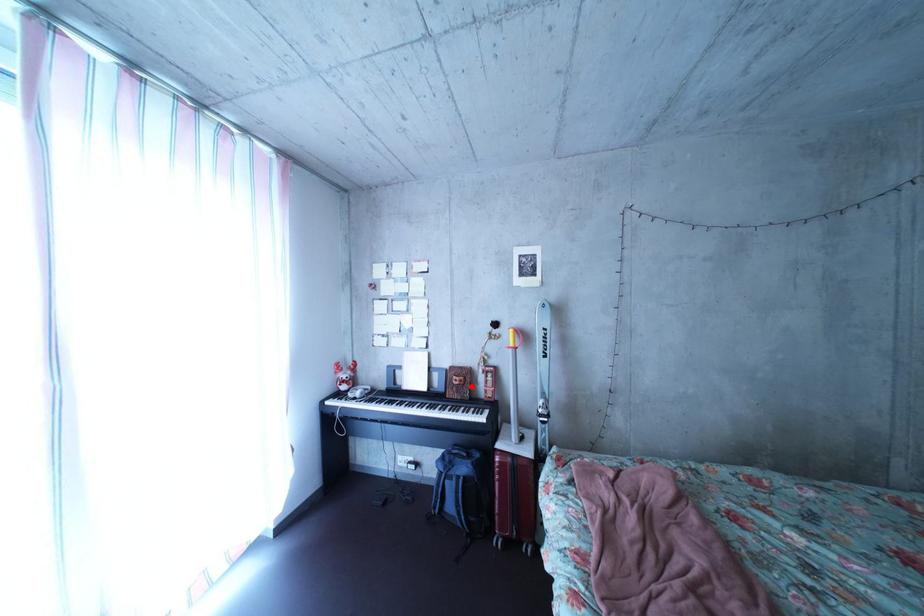
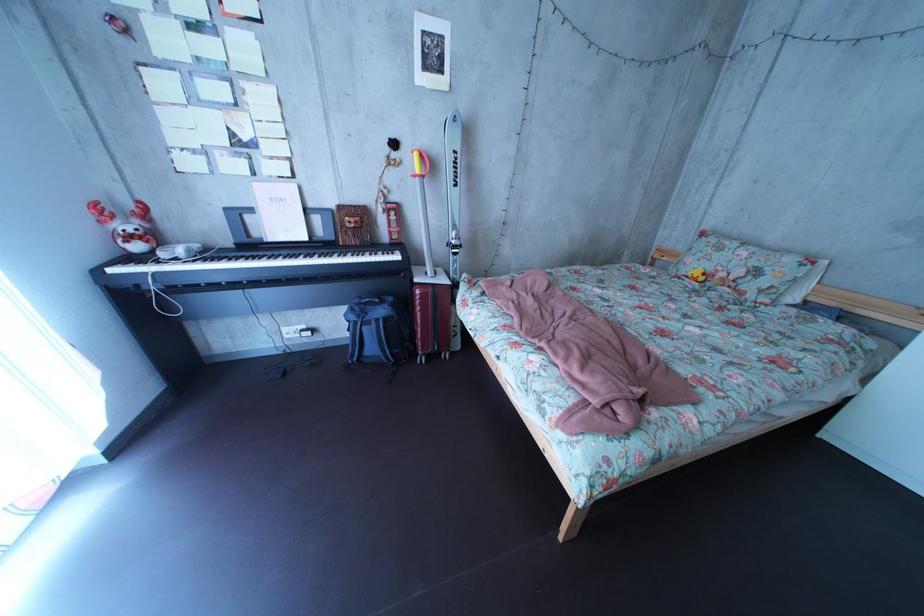
Find the pixel in the second image that matches the highlighted location in the first image.

(367, 228)